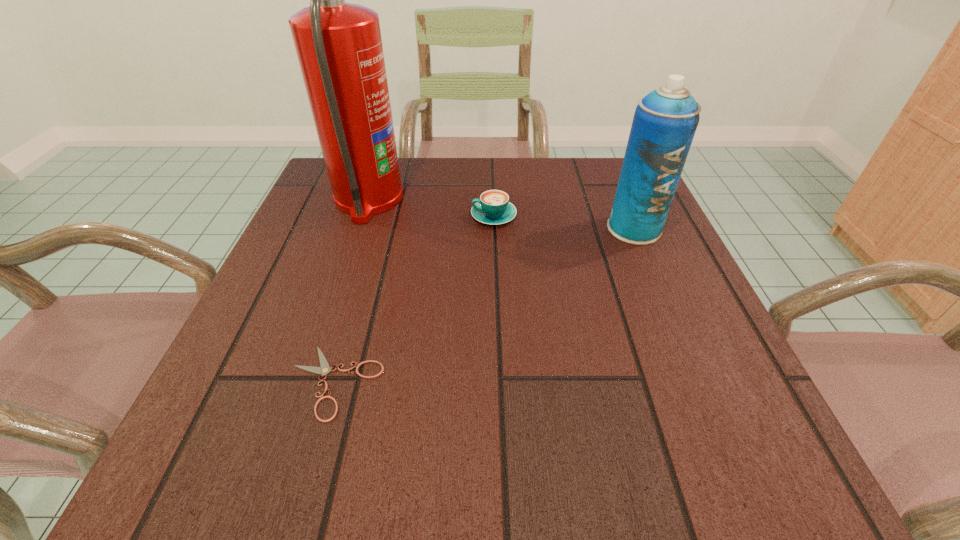
What are the coordinates of `free space between the tallest object and the shears` in the screenshot? It's located at (351, 291).

Identify the location of vacant point located between the second shortest object and the shortest object. The image size is (960, 540). (415, 299).

Locate an element on the screen. The image size is (960, 540). empty location between the third tallest object and the fire extinguisher is located at coordinates (431, 208).

Find the location of `free spot between the rightmost object and the cappuccino`. free spot between the rightmost object and the cappuccino is located at coordinates click(x=564, y=222).

This screenshot has height=540, width=960. In order to click on vacant space that's between the cappuccino and the third shortest object in this screenshot , I will do `click(564, 222)`.

The image size is (960, 540). I want to click on object that is the third closest to the cappuccino, so click(x=324, y=369).

Identify which object is the nearest to the third object from left to right. Please provide its 2D coordinates. Your answer should be formatted as a tuple, i.e. [(x, y)], where the tuple contains the x and y coordinates of a point satisfying the conditions above.

[(339, 47)]

You are a GUI agent. You are given a task and a screenshot of the screen. Output one action in this format:
    pyautogui.click(x=<x>, y=<y>)
    Task: Click on the vacant space that satisfies the following two spatial constraints: 1. on the instruction side of the fire extinguisher; 2. on the back side of the shears
    This screenshot has width=960, height=540.
    Given the screenshot: What is the action you would take?
    pyautogui.click(x=307, y=382)

What are the coordinates of `free location that satisfies the following two spatial constraints: 1. on the instruction side of the tallest object; 2. on the back side of the aerosol can` in the screenshot? It's located at (358, 228).

Locate an element on the screen. free space that satisfies the following two spatial constraints: 1. on the instruction side of the shortest object; 2. on the left side of the tallest object is located at coordinates (307, 382).